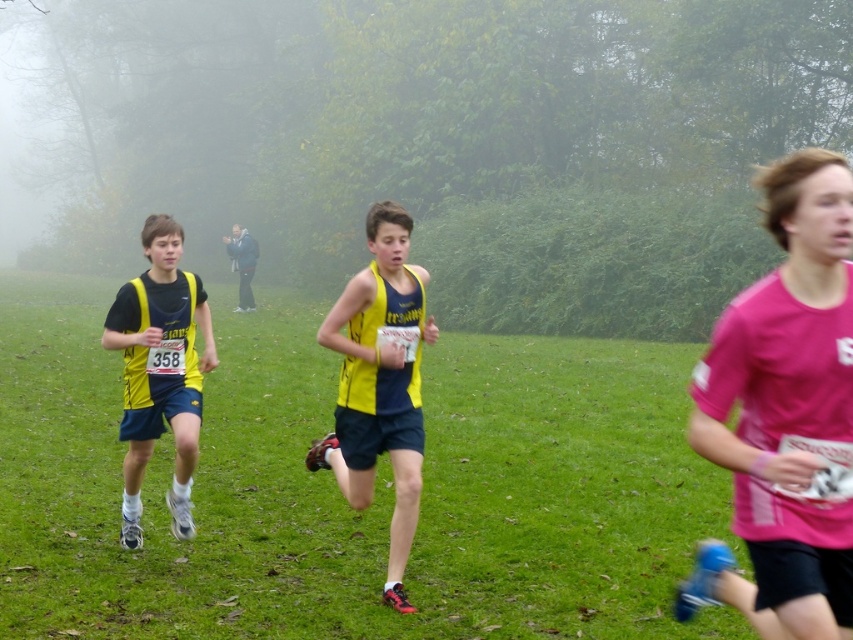
Question: From the image, what is the correct spatial relationship of pink fabric shirt at right in relation to yellow matte tank top at center?

Choices:
 (A) left
 (B) right

Answer: (B)

Question: Does pink fabric shirt at right have a larger size compared to matte yellow and black running outfit at left?

Choices:
 (A) yes
 (B) no

Answer: (B)

Question: Is yellow matte tank top at center smaller than matte yellow and black running outfit at left?

Choices:
 (A) yes
 (B) no

Answer: (B)

Question: Which object is farther from the camera taking this photo?

Choices:
 (A) matte yellow and black running outfit at left
 (B) pink fabric shirt at right

Answer: (A)

Question: Estimate the real-world distances between objects in this image. Which object is closer to the dark blue jacket at center?

Choices:
 (A) matte yellow and black running outfit at left
 (B) pink fabric shirt at right
 (C) yellow matte tank top at center

Answer: (A)

Question: Which object is the closest to the yellow matte tank top at center?

Choices:
 (A) pink fabric shirt at right
 (B) dark blue jacket at center

Answer: (A)